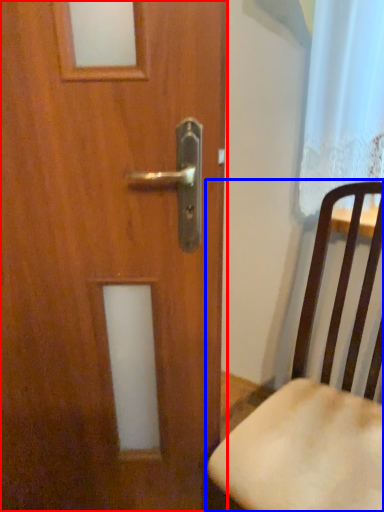
Question: Which of the following is the farthest to the observer, door (highlighted by a red box) or chair (highlighted by a blue box)?

Choices:
 (A) door
 (B) chair

Answer: (A)